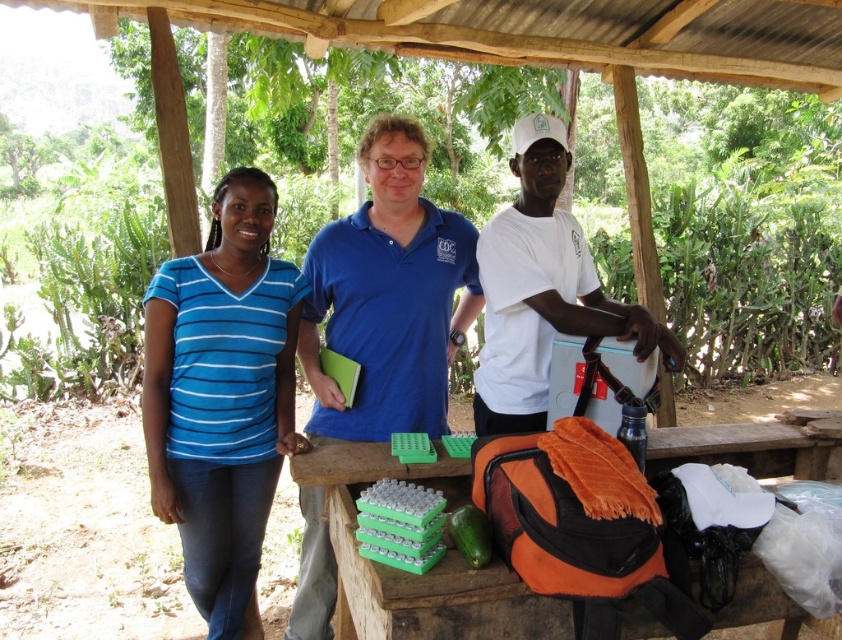
Is point (238, 240) positioned after point (611, 326)?

Yes, it is.

Consider the image. Does blue striped shirt at left have a larger size compared to white matte shirt at center?

Yes, blue striped shirt at left is bigger than white matte shirt at center.

Which is behind, point (264, 241) or point (537, 250)?

Positioned behind is point (264, 241).

Find the location of a particular element. The image size is (842, 640). blue striped shirt at left is located at coordinates (222, 396).

Is blue striped shirt at left smaller than blue cotton shirt at center?

Correct, blue striped shirt at left occupies less space than blue cotton shirt at center.

Does blue striped shirt at left lie in front of blue cotton shirt at center?

Yes.

Who is more distant from viewer, (254, 336) or (352, 349)?

Positioned behind is point (352, 349).

Where is `blue striped shirt at left`? The width and height of the screenshot is (842, 640). blue striped shirt at left is located at coordinates (222, 396).

Is point (372, 563) more distant than point (680, 365)?

No.

From the picture: Is orange fabric-covered bag at lower center in front of white matte shirt at center?

That is True.

You are a GUI agent. You are given a task and a screenshot of the screen. Output one action in this format:
    pyautogui.click(x=<x>, y=<y>)
    Task: Click on the orange fabric-covered bag at lower center
    This screenshot has height=640, width=842.
    Given the screenshot: What is the action you would take?
    pyautogui.click(x=414, y=573)